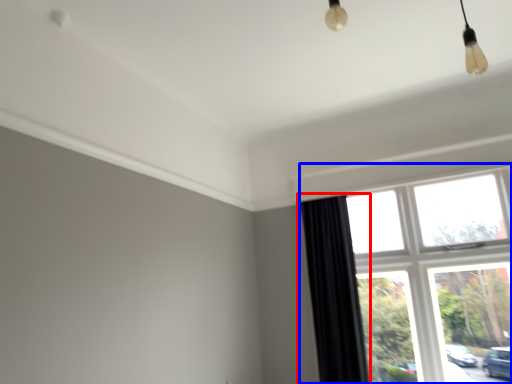
Question: Which point is closer to the camera, curtain (highlighted by a red box) or window (highlighted by a blue box)?

Choices:
 (A) curtain
 (B) window

Answer: (B)